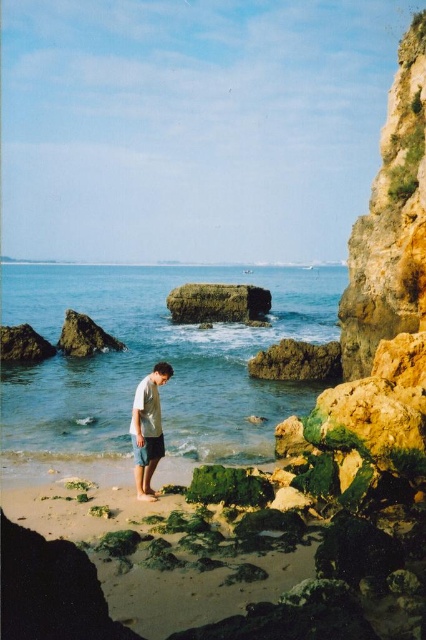
Question: Among these points, which one is nearest to the camera?

Choices:
 (A) [x=149, y=452]
 (B) [x=94, y=554]
 (C) [x=94, y=288]
 (D) [x=135, y=440]

Answer: (B)

Question: Considering the real-world distances, which object is farthest from the light gray cotton shorts at center?

Choices:
 (A) dark gray shorts at lower center
 (B) sandy beach at lower center
 (C) clear blue water at center

Answer: (C)

Question: Can you confirm if clear blue water at center is thinner than dark gray shorts at lower center?

Choices:
 (A) no
 (B) yes

Answer: (A)

Question: Which point is farther to the camera?

Choices:
 (A) (149, 454)
 (B) (273, 394)
 (C) (135, 435)

Answer: (B)

Question: From the image, what is the correct spatial relationship of light gray cotton shorts at center in relation to dark gray shorts at lower center?

Choices:
 (A) left
 (B) right

Answer: (B)

Question: In this image, where is light gray cotton shorts at center located relative to dark gray shorts at lower center?

Choices:
 (A) above
 (B) below

Answer: (A)